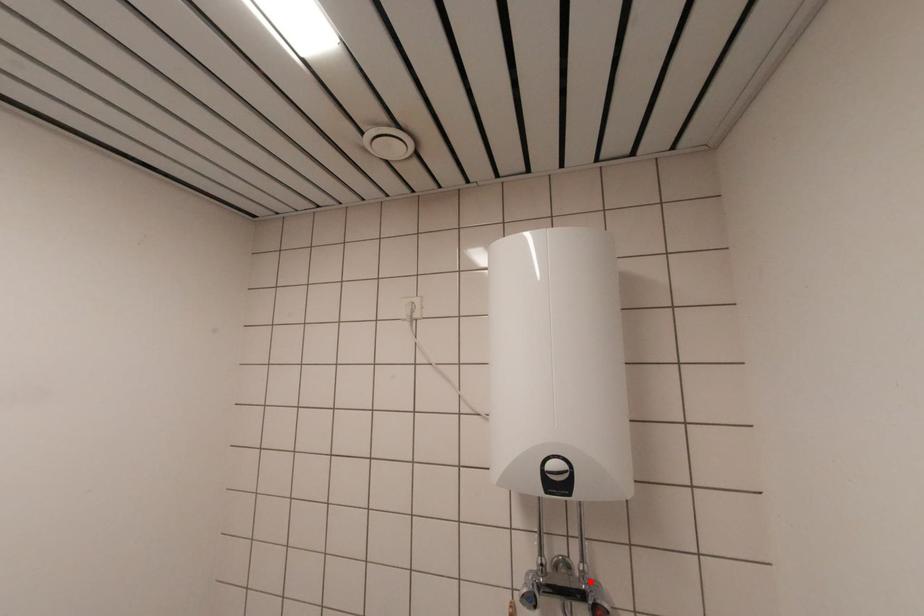
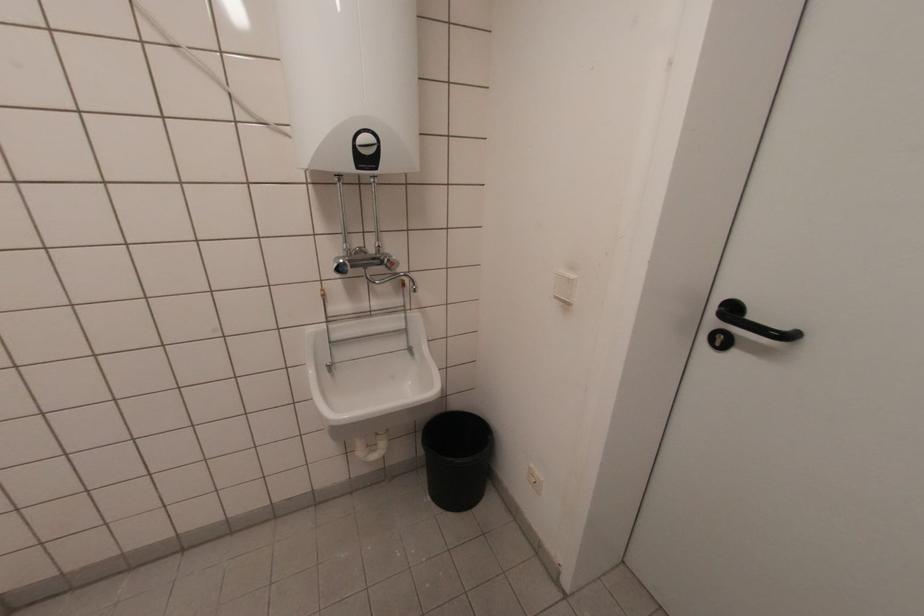
Locate, in the second image, the point that corresponds to the highlighted location in the first image.

(383, 254)